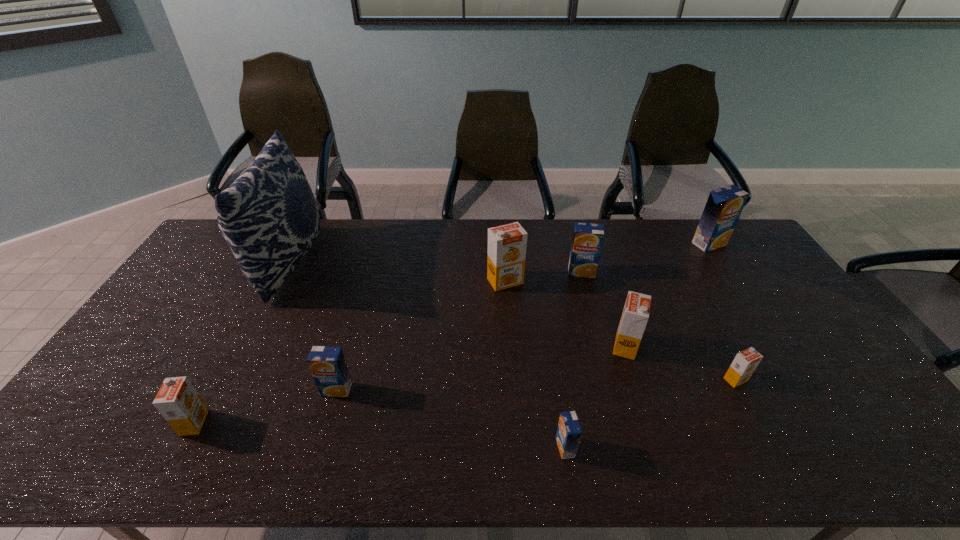
Locate an element on the screen. This screenshot has width=960, height=540. blue cushion is located at coordinates (269, 217).

Find the location of a particular element. the tallest object is located at coordinates (269, 217).

Where is `the farthest blue orange_juice`? The image size is (960, 540). the farthest blue orange_juice is located at coordinates (722, 210).

I want to click on the rightmost orange_juice, so click(x=722, y=210).

You are a GUI agent. You are given a task and a screenshot of the screen. Output one action in this format:
    pyautogui.click(x=<x>, y=<y>)
    Task: Click on the biggest orange orange juice
    
    Given the screenshot: What is the action you would take?
    pyautogui.click(x=507, y=243)

I want to click on the farthest orange orange juice, so click(x=507, y=243).

Where is `the third smallest blue orange_juice`? the third smallest blue orange_juice is located at coordinates click(587, 241).

The height and width of the screenshot is (540, 960). Identify the location of the third nearest blue orange_juice. (587, 241).

Image resolution: width=960 pixels, height=540 pixels. Find the location of `the fourth farthest orange_juice`. the fourth farthest orange_juice is located at coordinates (635, 315).

This screenshot has height=540, width=960. I want to click on the second farthest orange orange juice, so click(x=635, y=315).